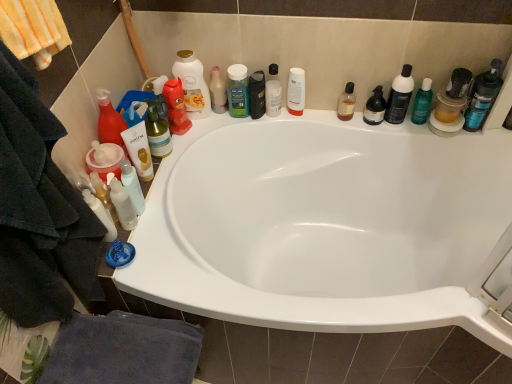
Question: Would you say translucent plastic spray bottle at upper right, acting as the sixth toiletry starting from the left, is a long distance from white glossy bottle at lower left, placed as the first mouthwash when sorted from left to right?

Choices:
 (A) yes
 (B) no

Answer: (B)

Question: From the image's perspective, is translucent plastic spray bottle at upper right, acting as the sixth toiletry starting from the left, under white glossy bottle at lower left, the sixth mouthwash in the right-to-left sequence?

Choices:
 (A) yes
 (B) no

Answer: (B)

Question: Is translucent plastic spray bottle at upper right, acting as the sixth toiletry starting from the left, beside white glossy bottle at lower left, placed as the first mouthwash when sorted from left to right?

Choices:
 (A) yes
 (B) no

Answer: (B)

Question: From a real-world perspective, is translucent plastic spray bottle at upper right, which is counted as the 2th toiletry, starting from the right, physically above white glossy bottle at lower left, placed as the first mouthwash when sorted from left to right?

Choices:
 (A) yes
 (B) no

Answer: (B)

Question: Is translucent plastic spray bottle at upper right, which is counted as the 2th toiletry, starting from the right, at the right side of white glossy bottle at lower left, the sixth mouthwash in the right-to-left sequence?

Choices:
 (A) no
 (B) yes

Answer: (B)

Question: Is translucent plastic spray bottle at upper right, acting as the sixth toiletry starting from the left, at the left side of white glossy bottle at lower left, placed as the first mouthwash when sorted from left to right?

Choices:
 (A) yes
 (B) no

Answer: (B)

Question: Does translucent amber liquid at upper right, acting as the 5th mouthwash starting from the left, turn towards black matte bottle at center?

Choices:
 (A) no
 (B) yes

Answer: (A)

Question: Is translucent amber liquid at upper right, acting as the 5th mouthwash starting from the left, turned away from black matte bottle at center?

Choices:
 (A) no
 (B) yes

Answer: (A)

Question: Is translucent amber liquid at upper right, the 2th mouthwash viewed from the right, at the right side of black matte bottle at center?

Choices:
 (A) no
 (B) yes

Answer: (B)

Question: Is translucent amber liquid at upper right, the 2th mouthwash viewed from the right, shorter than black matte bottle at center?

Choices:
 (A) yes
 (B) no

Answer: (A)

Question: Considering the relative positions of translucent amber liquid at upper right, acting as the 5th mouthwash starting from the left, and black matte bottle at center in the image provided, is translucent amber liquid at upper right, acting as the 5th mouthwash starting from the left, behind black matte bottle at center?

Choices:
 (A) no
 (B) yes

Answer: (A)

Question: Is translucent amber liquid at upper right, acting as the 5th mouthwash starting from the left, not near black matte bottle at center?

Choices:
 (A) no
 (B) yes

Answer: (A)

Question: Can you see white glossy lotion at lower left, placed as the 1th toiletry when sorted from left to right, touching green glossy bottle at upper right, marked as the 1th toiletry in a right-to-left arrangement?

Choices:
 (A) yes
 (B) no

Answer: (B)